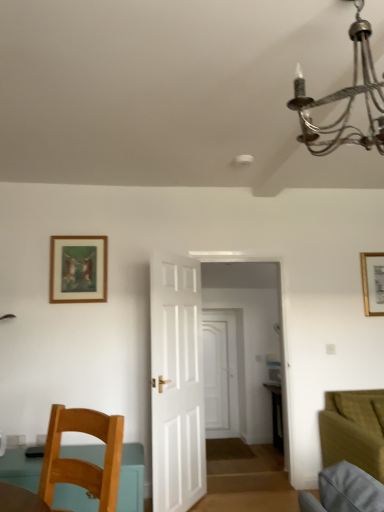
What do you see at coordinates (81, 460) in the screenshot? The width and height of the screenshot is (384, 512). I see `wooden chair at lower left` at bounding box center [81, 460].

Identify the location of white matte door at center, the first door from the back. (220, 374).

The width and height of the screenshot is (384, 512). I want to click on gold-framed picture at upper right, which is the second picture frame in front-to-back order, so click(373, 283).

In order to face wooden framed artwork at upper left, which is counted as the 1th picture frame, starting from the left, should I rotate leftwards or rightwards?

It's best to rotate left around 14.698 degrees.

Measure the distance between silver wire chandelier at upper right and camera.

The depth of silver wire chandelier at upper right is 4.24 feet.

What is the approximate width of silver wire chandelier at upper right?

silver wire chandelier at upper right is 29.14 inches in width.

Find the location of a particular element. wooden chair at lower left is located at coordinates (81, 460).

Is teal matte table at lower left situated inside white wooden door at center, placed as the 2th door when sorted from right to left, or outside?

teal matte table at lower left is spatially situated outside white wooden door at center, placed as the 2th door when sorted from right to left.

From a real-world perspective, who is located lower, teal matte table at lower left or white wooden door at center, placed as the 2th door when sorted from right to left?

From a 3D spatial view, teal matte table at lower left is below.

Would you consider teal matte table at lower left to be distant from white wooden door at center, the 2th door from the back?

Yes, teal matte table at lower left and white wooden door at center, the 2th door from the back, are located far from each other.

Does teal matte table at lower left turn towards white wooden door at center, the 1th door viewed from the left?

No, teal matte table at lower left is not aimed at white wooden door at center, the 1th door viewed from the left.

Does point (123, 426) come behind point (229, 397)?

That is False.

Between wooden chair at lower left and white matte door at center, which is counted as the 2th door, starting from the left, which one has more height?

Standing taller between the two is white matte door at center, which is counted as the 2th door, starting from the left.

Locate an element on the screen. Image resolution: width=384 pixels, height=512 pixels. chair located on the left of white matte door at center, the 2th door positioned from the front is located at coordinates (81, 460).

Is wooden chair at lower left at the left side of white matte door at center, which is counted as the 2th door, starting from the left?

Yes, wooden chair at lower left is to the left of white matte door at center, which is counted as the 2th door, starting from the left.

Measure the distance between velvet olive green couch at lower right and teal matte table at lower left.

They are 2.10 meters apart.

I want to click on couch in front of the teal matte table at lower left, so click(352, 431).

From a real-world perspective, is velvet olive green couch at lower right physically located above or below teal matte table at lower left?

From a real-world perspective, velvet olive green couch at lower right is physically above teal matte table at lower left.

Between velvet olive green couch at lower right and teal matte table at lower left, which one appears on the left side from the viewer's perspective?

teal matte table at lower left.

Considering the relative positions of wooden framed artwork at upper left, which ranks as the first picture frame in front-to-back order, and wooden chair at lower left in the image provided, is wooden framed artwork at upper left, which ranks as the first picture frame in front-to-back order, behind wooden chair at lower left?

Yes, wooden framed artwork at upper left, which ranks as the first picture frame in front-to-back order, is further from the camera.

Based on the photo, would you consider wooden framed artwork at upper left, which is counted as the 2th picture frame, starting from the back, to be distant from wooden chair at lower left?

That's right, there is a large distance between wooden framed artwork at upper left, which is counted as the 2th picture frame, starting from the back, and wooden chair at lower left.

Considering the relative positions of wooden framed artwork at upper left, which is counted as the 1th picture frame, starting from the left, and wooden chair at lower left in the image provided, is wooden framed artwork at upper left, which is counted as the 1th picture frame, starting from the left, to the right of wooden chair at lower left from the viewer's perspective?

No, wooden framed artwork at upper left, which is counted as the 1th picture frame, starting from the left, is not to the right of wooden chair at lower left.

In the scene shown: How many degrees apart are the facing directions of wooden framed artwork at upper left, which is counted as the 2th picture frame, starting from the back, and wooden chair at lower left?

The angle between the facing direction of wooden framed artwork at upper left, which is counted as the 2th picture frame, starting from the back, and the facing direction of wooden chair at lower left is 43 degrees.

This screenshot has width=384, height=512. Identify the location of door above the wooden chair at lower left (from a real-world perspective). (176, 383).

Is point (176, 460) farther from viewer compared to point (67, 416)?

Yes, it is.

Considering the positions of objects white wooden door at center, placed as the 2th door when sorted from right to left, and wooden chair at lower left in the image provided, who is behind, white wooden door at center, placed as the 2th door when sorted from right to left, or wooden chair at lower left?

white wooden door at center, placed as the 2th door when sorted from right to left, is further from the camera.

Which of these two, white wooden door at center, the 2th door from the back, or wooden chair at lower left, is thinner?

Thinner between the two is white wooden door at center, the 2th door from the back.

Is velvet olive green couch at lower right shorter than white wooden door at center, the 2th door from the back?

Indeed, velvet olive green couch at lower right has a lesser height compared to white wooden door at center, the 2th door from the back.

Could you tell me if velvet olive green couch at lower right is turned towards white wooden door at center, placed as the 2th door when sorted from right to left?

No, velvet olive green couch at lower right is not turned towards white wooden door at center, placed as the 2th door when sorted from right to left.

From the image's perspective, relative to white wooden door at center, the 1th door viewed from the left, is velvet olive green couch at lower right above or below?

velvet olive green couch at lower right is situated lower than white wooden door at center, the 1th door viewed from the left, in the image.

Is velvet olive green couch at lower right inside the boundaries of white wooden door at center, which appears as the 1th door when viewed from the front, or outside?

velvet olive green couch at lower right cannot be found inside white wooden door at center, which appears as the 1th door when viewed from the front.

Is white wooden door at center, the 1th door viewed from the left, bigger or smaller than silver wire chandelier at upper right?

white wooden door at center, the 1th door viewed from the left, is smaller than silver wire chandelier at upper right.

Is white wooden door at center, the 2th door from the back, turned away from silver wire chandelier at upper right?

white wooden door at center, the 2th door from the back, is not turned away from silver wire chandelier at upper right.

Which is correct: white wooden door at center, the 1th door viewed from the left, is inside silver wire chandelier at upper right, or outside of it?

white wooden door at center, the 1th door viewed from the left, is located beyond the bounds of silver wire chandelier at upper right.

Does point (170, 318) come farther from viewer compared to point (350, 35)?

Yes, it is.

The image size is (384, 512). I want to click on table below the white wooden door at center, the 2th door from the back (from the image's perspective), so click(131, 479).

This screenshot has height=512, width=384. Identify the location of the 2nd door behind the wooden chair at lower left, starting your count from the anchor. (220, 374).

Based on their spatial positions, is velvet olive green couch at lower right or wooden framed artwork at upper left, which ranks as the second picture frame in right-to-left order, further from teal matte table at lower left?

Among the two, velvet olive green couch at lower right is located further to teal matte table at lower left.

Based on their spatial positions, is gold-framed picture at upper right, acting as the 1th picture frame starting from the right, or velvet olive green couch at lower right further from white wooden door at center, the 2th door from the back?

gold-framed picture at upper right, acting as the 1th picture frame starting from the right, is positioned further to the anchor white wooden door at center, the 2th door from the back.

Estimate the real-world distances between objects in this image. Which object is closer to wooden framed artwork at upper left, which ranks as the first picture frame in front-to-back order, silver wire chandelier at upper right or teal matte table at lower left?

teal matte table at lower left is positioned closer to the anchor wooden framed artwork at upper left, which ranks as the first picture frame in front-to-back order.

Which object lies nearer to the anchor point silver wire chandelier at upper right, white matte door at center, the first door from the back, or gold-framed picture at upper right, which is the second picture frame in front-to-back order?

The object closer to silver wire chandelier at upper right is gold-framed picture at upper right, which is the second picture frame in front-to-back order.

Considering their positions, is white wooden door at center, which appears as the 1th door when viewed from the front, positioned further to silver wire chandelier at upper right than wooden chair at lower left?

white wooden door at center, which appears as the 1th door when viewed from the front, lies further to silver wire chandelier at upper right than the other object.

Estimate the real-world distances between objects in this image. Which object is further from wooden chair at lower left, silver wire chandelier at upper right or white wooden door at center, the 1th door viewed from the left?

Based on the image, silver wire chandelier at upper right appears to be further to wooden chair at lower left.

Considering their positions, is silver wire chandelier at upper right positioned closer to wooden framed artwork at upper left, which ranks as the first picture frame in front-to-back order, than wooden chair at lower left?

Among the two, wooden chair at lower left is located nearer to wooden framed artwork at upper left, which ranks as the first picture frame in front-to-back order.

From the image, which object appears to be nearer to teal matte table at lower left, white wooden door at center, placed as the 2th door when sorted from right to left, or silver wire chandelier at upper right?

white wooden door at center, placed as the 2th door when sorted from right to left.

Locate an element on the screen. chair between silver wire chandelier at upper right and white wooden door at center, placed as the 2th door when sorted from right to left, along the z-axis is located at coordinates (81, 460).

Identify the location of couch between silver wire chandelier at upper right and teal matte table at lower left from top to bottom. (352, 431).

Locate an element on the screen. The height and width of the screenshot is (512, 384). picture frame between wooden chair at lower left and gold-framed picture at upper right, marked as the first picture frame in a back-to-front arrangement, in the front-back direction is located at coordinates pyautogui.click(x=78, y=269).

Identify the location of chair between silver wire chandelier at upper right and teal matte table at lower left vertically. This screenshot has width=384, height=512. (81, 460).